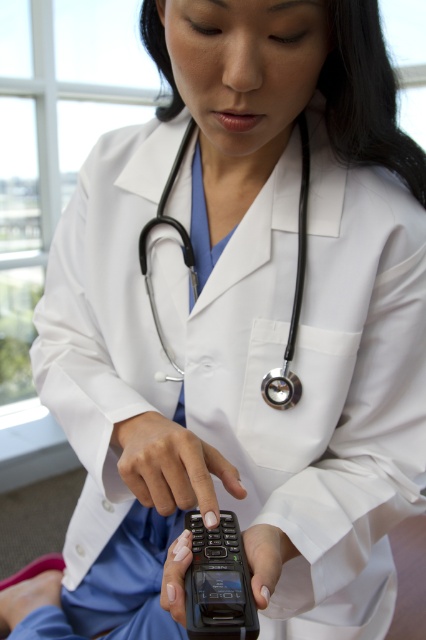
Where is `smooth skin hand at center`? This screenshot has width=426, height=640. smooth skin hand at center is located at coordinates (172, 467).

Can you confirm if smooth skin hand at center is shorter than black rubber stethoscope at center?

Correct, smooth skin hand at center is not as tall as black rubber stethoscope at center.

Which is behind, point (161, 433) or point (268, 385)?

Point (268, 385)

Identify the location of smooth skin hand at center. The image size is (426, 640). (172, 467).

Between black rubber stethoscope at center and black matte phone at center, which one appears on the left side from the viewer's perspective?

black rubber stethoscope at center is more to the left.

Based on the photo, is black rubber stethoscope at center below black matte phone at center?

No, black rubber stethoscope at center is not below black matte phone at center.

I want to click on black rubber stethoscope at center, so click(x=293, y=296).

Which is in front, point (161, 470) or point (176, 557)?

Point (176, 557)

Does smooth skin hand at center have a lesser height compared to black matte phone at center?

Incorrect, smooth skin hand at center's height does not fall short of black matte phone at center's.

The image size is (426, 640). Describe the element at coordinates (172, 467) in the screenshot. I see `smooth skin hand at center` at that location.

Image resolution: width=426 pixels, height=640 pixels. Identify the location of smooth skin hand at center. (172, 467).